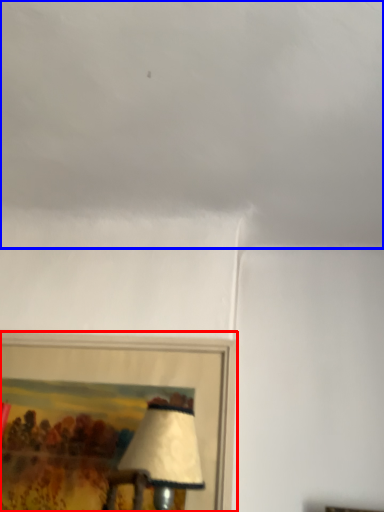
Question: Which object is further to the camera taking this photo, picture frame (highlighted by a red box) or cloud (highlighted by a blue box)?

Choices:
 (A) picture frame
 (B) cloud

Answer: (A)